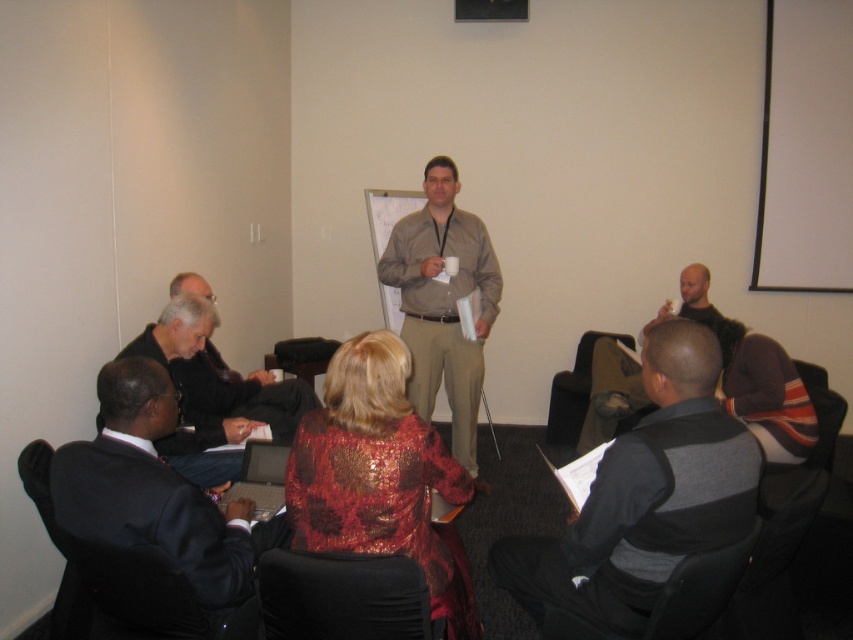
Consider the image. Measure the distance between point [334,582] and camera.

5.10 feet

Is black fabric chair at lower center smaller than dark brown leather jacket at upper right?

Yes, black fabric chair at lower center is smaller than dark brown leather jacket at upper right.

Image resolution: width=853 pixels, height=640 pixels. What do you see at coordinates (343, 596) in the screenshot?
I see `black fabric chair at lower center` at bounding box center [343, 596].

This screenshot has width=853, height=640. What are the coordinates of `black fabric chair at lower center` in the screenshot? It's located at (343, 596).

Does striped sweater at lower right have a greater width compared to black fabric chair at lower center?

Indeed, striped sweater at lower right has a greater width compared to black fabric chair at lower center.

Find the location of a particular element. The width and height of the screenshot is (853, 640). striped sweater at lower right is located at coordinates (642, 500).

Find the location of a particular element. striped sweater at lower right is located at coordinates (642, 500).

Can you confirm if matte khaki shirt at center is positioned above brown fabric chair at lower center?

Yes, matte khaki shirt at center is above brown fabric chair at lower center.

Does point (454, 385) come closer to viewer compared to point (589, 353)?

Yes, it is.

Which is in front, point (461, 424) or point (552, 403)?

Positioned in front is point (461, 424).

Identify the location of matte khaki shirt at center. This screenshot has height=640, width=853. (444, 304).